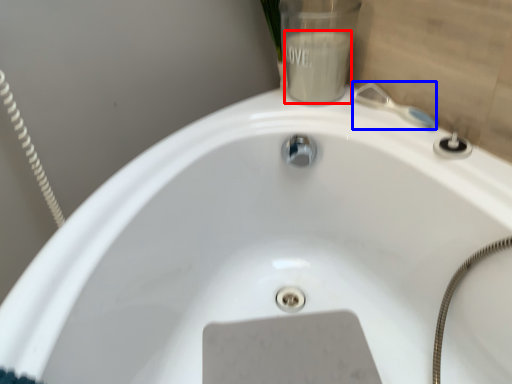
Question: Which object is further to the camera taking this photo, liquid (highlighted by a red box) or plumbing fixture (highlighted by a blue box)?

Choices:
 (A) liquid
 (B) plumbing fixture

Answer: (A)